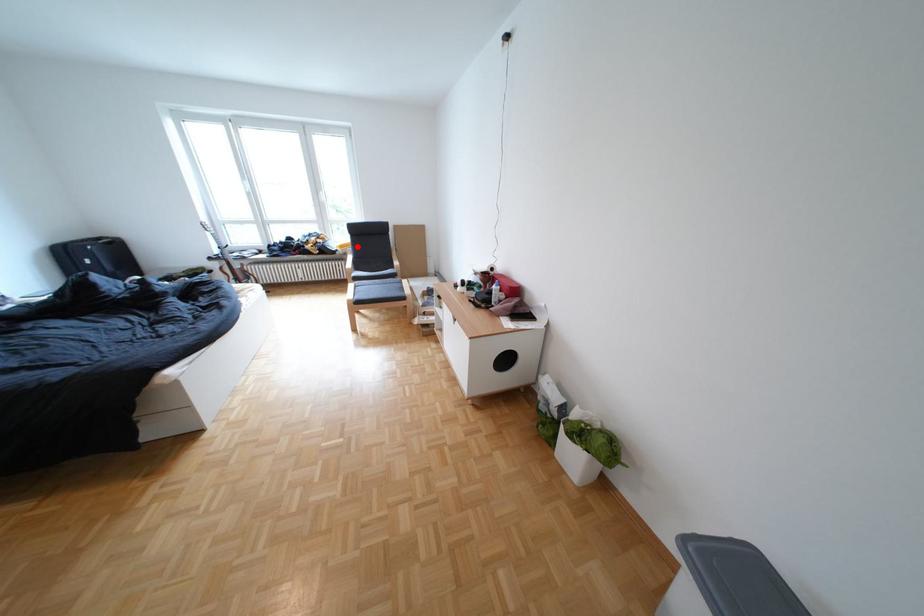
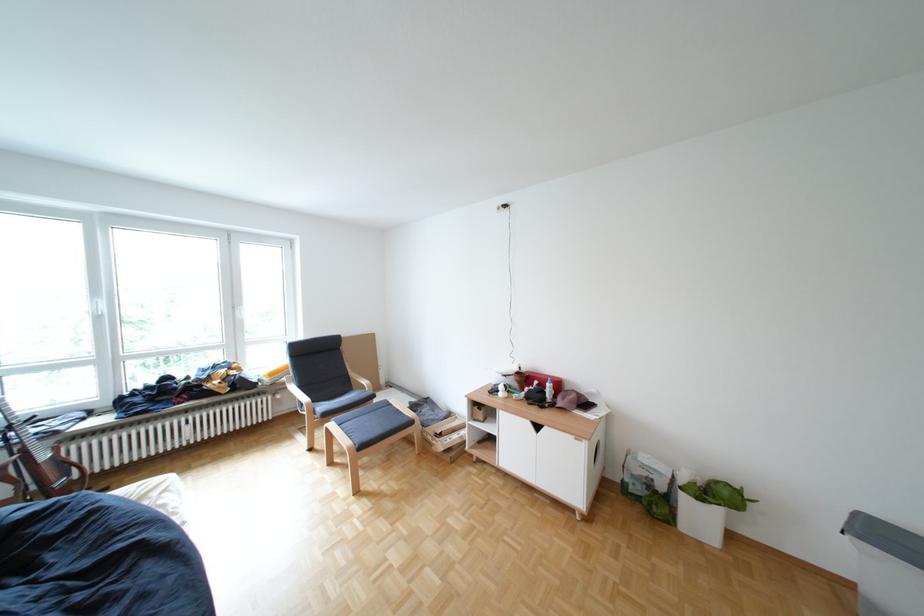
In the second image, find the point that corresponds to the highlighted location in the first image.

(286, 374)